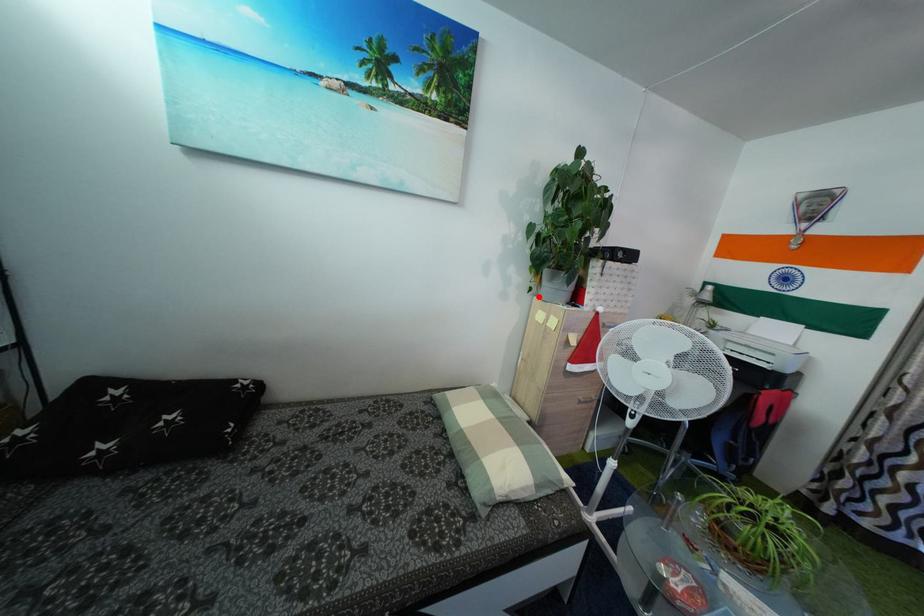
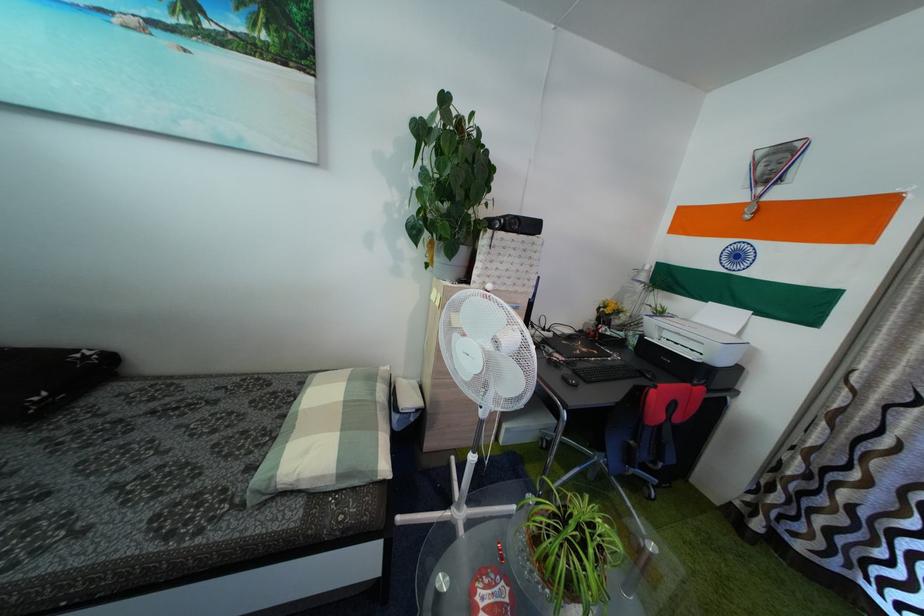
Find the pixel in the second image that matches the highlighted location in the first image.

(435, 273)